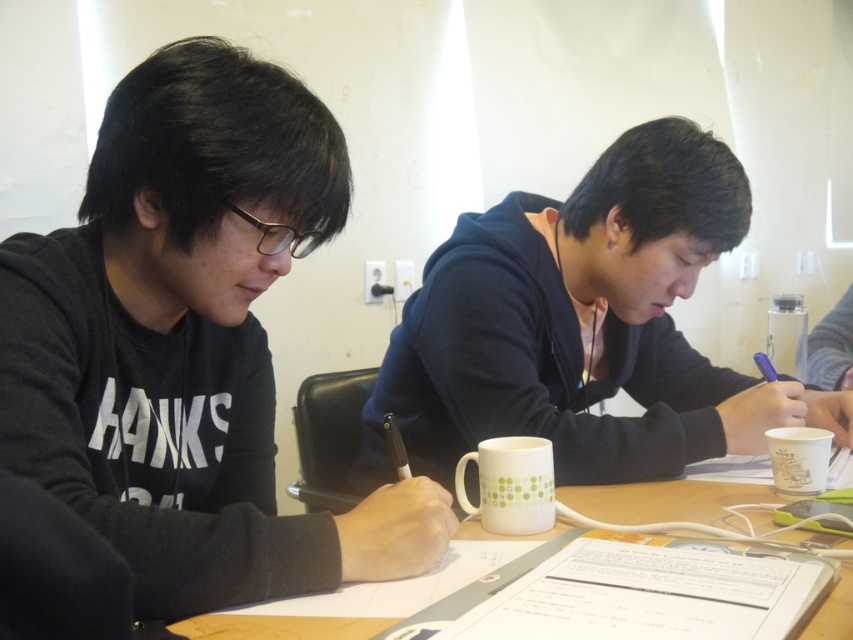
Question: Which object appears farthest from the camera in this image?

Choices:
 (A) matte black hoodie at center
 (B) black matte hoodie at left
 (C) white matte mug at center
 (D) white paper cup at lower right

Answer: (A)

Question: Is matte black hoodie at center closer to the viewer compared to white matte mug at center?

Choices:
 (A) yes
 (B) no

Answer: (B)

Question: Does white paper at center appear on the right side of white paper cup at lower right?

Choices:
 (A) yes
 (B) no

Answer: (B)

Question: Which is nearer to the white paper cup at lower right?

Choices:
 (A) black matte hoodie at left
 (B) matte black hoodie at center
 (C) white matte mug at center
 (D) white paper at center

Answer: (D)

Question: Can you confirm if white matte mug at center is positioned below white paper cup at lower right?

Choices:
 (A) yes
 (B) no

Answer: (A)

Question: Which point is farther from the camera taking this photo?

Choices:
 (A) (633, 145)
 (B) (489, 474)
 (C) (210, 634)

Answer: (A)